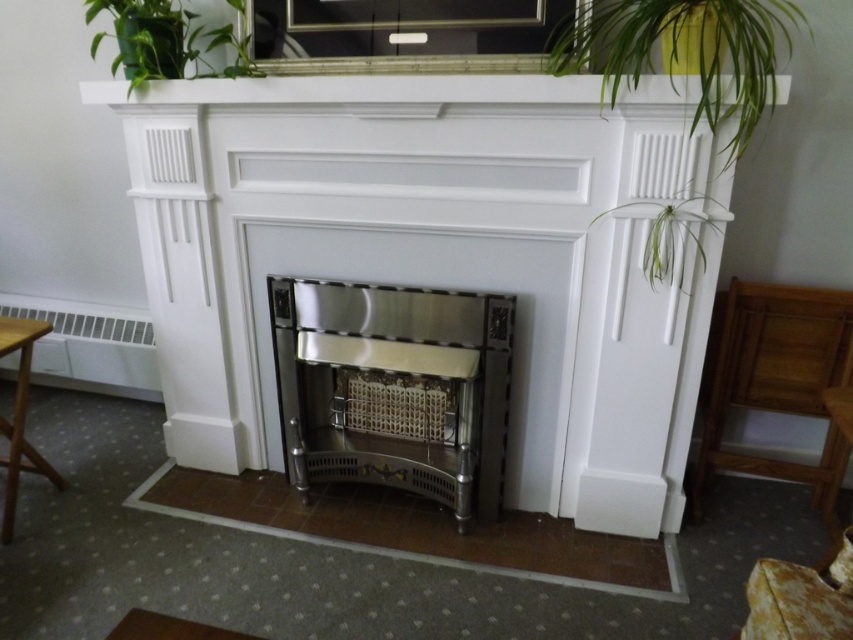
Question: Can you confirm if stainless steel fireplace at center is thinner than green leafy plant at upper right?

Choices:
 (A) no
 (B) yes

Answer: (B)

Question: Which object is the farthest from the green leafy plant at upper left?

Choices:
 (A) light brown wooden table at left
 (B) wooden table at lower right

Answer: (B)

Question: Which point is farther from the camera taking this photo?

Choices:
 (A) (389, 410)
 (B) (770, 40)
 (C) (845, 388)
 (D) (178, 61)

Answer: (A)

Question: Does green leafy plant at upper left appear on the right side of light brown wooden table at left?

Choices:
 (A) no
 (B) yes

Answer: (B)

Question: Which of the following is the farthest from the observer?

Choices:
 (A) wooden table at lower right
 (B) leather textured armchair at lower right
 (C) stainless steel fireplace at center

Answer: (C)

Question: Is stainless steel fireplace at center smaller than wooden table at lower right?

Choices:
 (A) no
 (B) yes

Answer: (A)